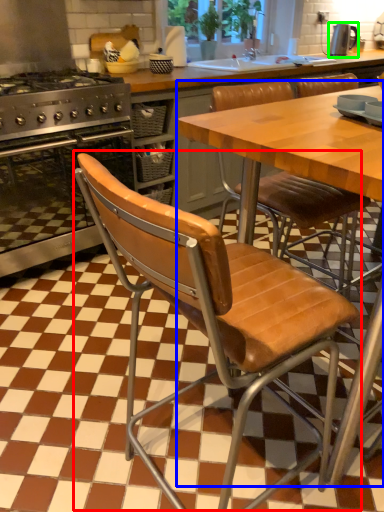
Question: Which object is the closest to the chair (highlighted by a red box)? Choose among these: table (highlighted by a blue box) or kitchen appliance (highlighted by a green box).

Choices:
 (A) table
 (B) kitchen appliance

Answer: (A)